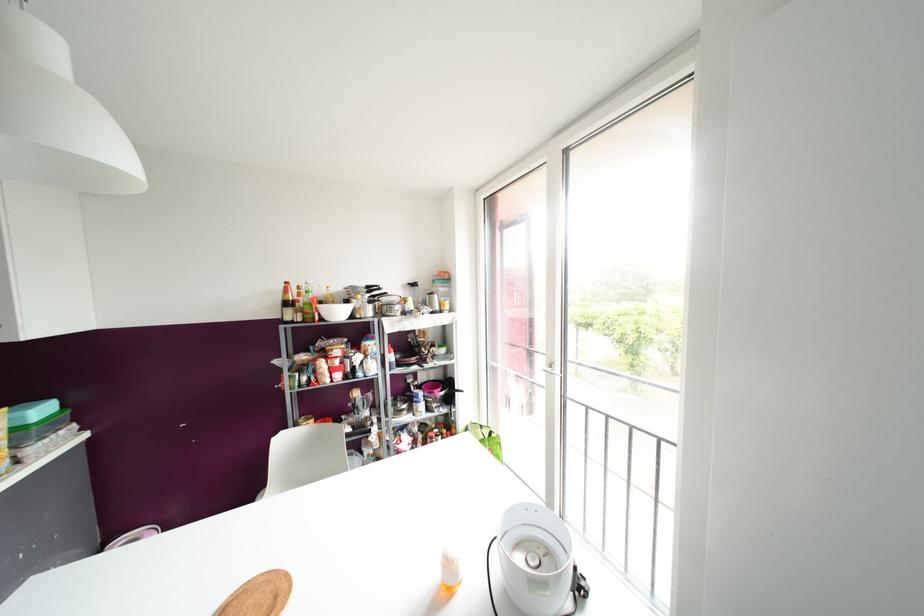
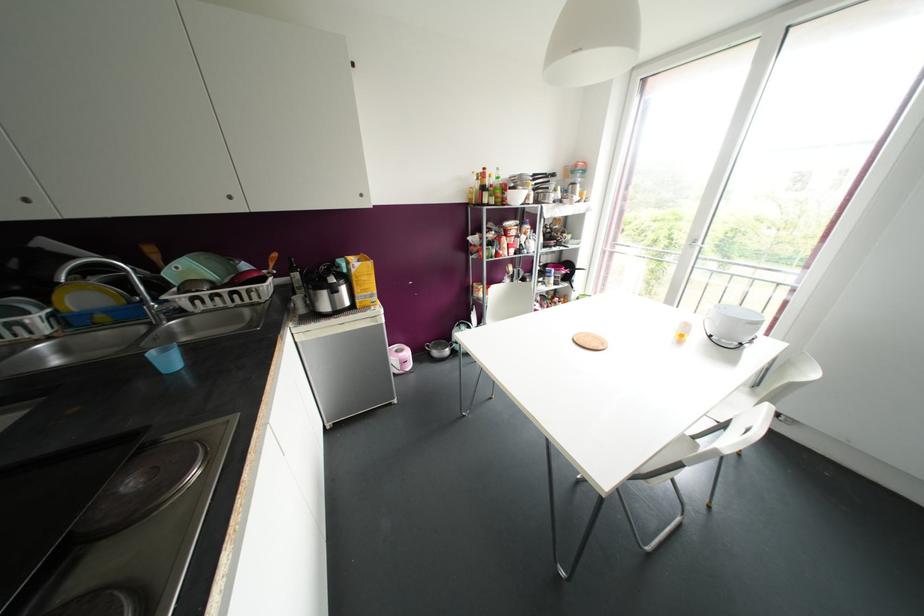
Where in the second image is the point corresponding to pixel 434 294 from the first image?

(578, 185)